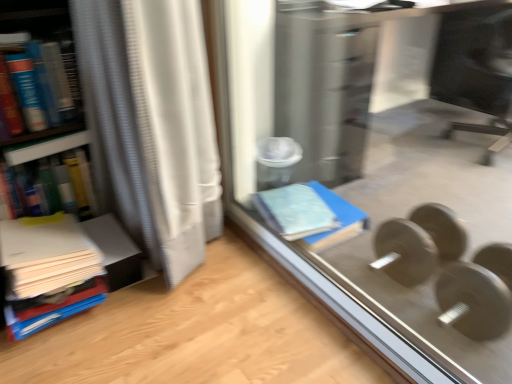
Question: Is hardcover book at left, the first book in the top-to-bottom sequence, not near white matte paper stack at left, positioned as the third book in top-to-bottom order?

Choices:
 (A) yes
 (B) no

Answer: (B)

Question: From a real-world perspective, is hardcover book at left, placed as the third book when sorted from bottom to top, beneath white matte paper stack at left, the 1th book from the bottom?

Choices:
 (A) no
 (B) yes

Answer: (A)

Question: From a real-world perspective, does hardcover book at left, placed as the third book when sorted from bottom to top, stand above white matte paper stack at left, the 1th book from the bottom?

Choices:
 (A) yes
 (B) no

Answer: (A)

Question: Does hardcover book at left, placed as the third book when sorted from bottom to top, have a smaller size compared to white matte paper stack at left, positioned as the third book in top-to-bottom order?

Choices:
 (A) no
 (B) yes

Answer: (A)

Question: Is hardcover book at left, the first book in the top-to-bottom sequence, next to white matte paper stack at left, positioned as the third book in top-to-bottom order, and touching it?

Choices:
 (A) yes
 (B) no

Answer: (B)

Question: From a real-world perspective, is white textured curtain at left physically located above or below metallic gray dumbbell at lower right, the first dumbbell in the back-to-front sequence?

Choices:
 (A) above
 (B) below

Answer: (A)

Question: From the image's perspective, is white textured curtain at left positioned above or below metallic gray dumbbell at lower right, which is counted as the second dumbbell, starting from the front?

Choices:
 (A) below
 (B) above

Answer: (B)

Question: Considering the relative positions of white textured curtain at left and metallic gray dumbbell at lower right, the first dumbbell in the back-to-front sequence, in the image provided, is white textured curtain at left to the left or to the right of metallic gray dumbbell at lower right, the first dumbbell in the back-to-front sequence,?

Choices:
 (A) right
 (B) left

Answer: (B)

Question: Considering the positions of white textured curtain at left and metallic gray dumbbell at lower right, the first dumbbell in the back-to-front sequence, in the image, is white textured curtain at left bigger or smaller than metallic gray dumbbell at lower right, the first dumbbell in the back-to-front sequence,?

Choices:
 (A) big
 (B) small

Answer: (A)

Question: From their relative heights in the image, would you say metallic gray dumbbell at lower right, the first dumbbell in the back-to-front sequence, is taller or shorter than white textured curtain at left?

Choices:
 (A) short
 (B) tall

Answer: (A)

Question: Choose the correct answer: Is metallic gray dumbbell at lower right, the first dumbbell in the back-to-front sequence, inside white textured curtain at left or outside it?

Choices:
 (A) outside
 (B) inside

Answer: (A)

Question: Is point (378, 249) positioned closer to the camera than point (183, 228)?

Choices:
 (A) closer
 (B) farther

Answer: (B)

Question: Looking at the image, does metallic gray dumbbell at lower right, the first dumbbell in the back-to-front sequence, seem bigger or smaller compared to white textured curtain at left?

Choices:
 (A) small
 (B) big

Answer: (A)

Question: In terms of height, does white textured curtain at left look taller or shorter compared to matte plastic book at left, the second book from the top?

Choices:
 (A) short
 (B) tall

Answer: (B)

Question: From the image's perspective, relative to matte plastic book at left, the 2th book ordered from the bottom, is white textured curtain at left above or below?

Choices:
 (A) below
 (B) above

Answer: (B)